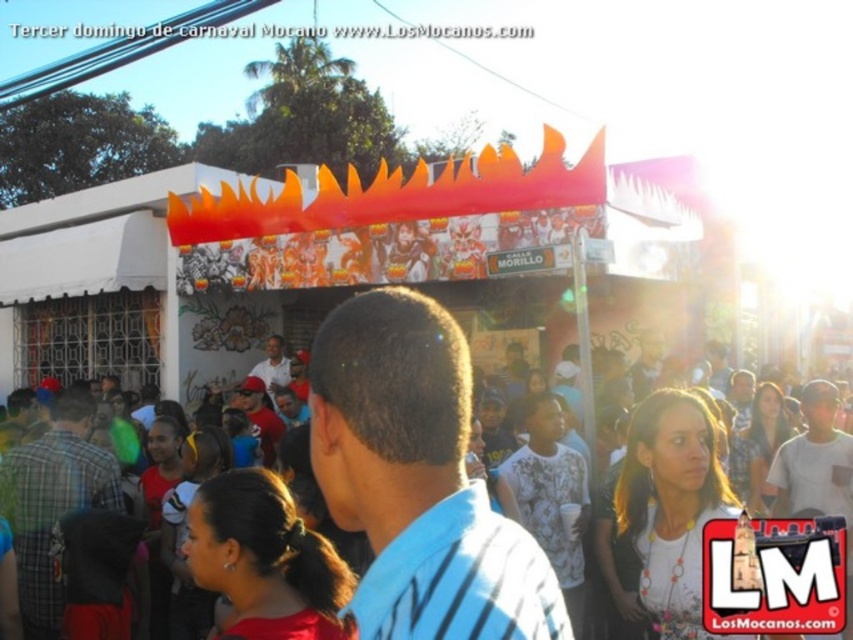
Question: Does blue striped shirt at center lie behind plaid fabric shirt at lower left?

Choices:
 (A) yes
 (B) no

Answer: (B)

Question: Which of these objects is positioned closest to the matte black crowd at center?

Choices:
 (A) plaid fabric shirt at lower left
 (B) blue striped shirt at center
 (C) white matte shirt at center

Answer: (B)

Question: Which is nearer to the matte black crowd at center?

Choices:
 (A) blue striped shirt at center
 (B) plaid fabric shirt at lower left
 (C) white matte shirt at center

Answer: (A)

Question: Can you confirm if blue striped shirt at center is positioned to the left of white matte shirt at center?

Choices:
 (A) no
 (B) yes

Answer: (A)

Question: Which of the following is the farthest from the observer?

Choices:
 (A) plaid fabric shirt at lower left
 (B) white matte shirt at center

Answer: (B)

Question: Can you confirm if blue striped shirt at center is positioned above plaid fabric shirt at lower left?

Choices:
 (A) yes
 (B) no

Answer: (A)